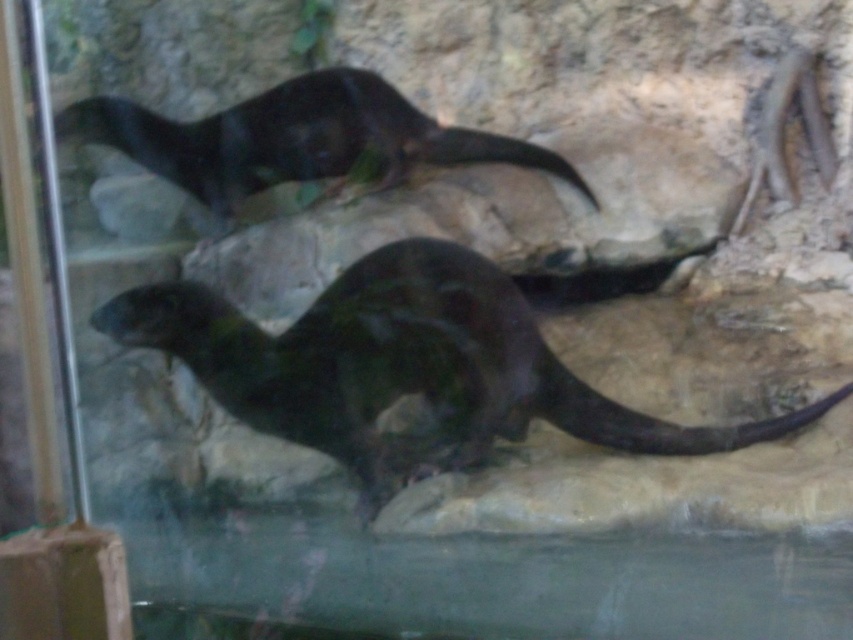
Who is higher up, shiny black otter at center or shiny black otter at upper center?

Positioned higher is shiny black otter at upper center.

Can you confirm if shiny black otter at center is bigger than shiny black otter at upper center?

Correct, shiny black otter at center is larger in size than shiny black otter at upper center.

Is point (343, 316) farther from viewer compared to point (374, 92)?

No.

The width and height of the screenshot is (853, 640). What are the coordinates of `shiny black otter at center` in the screenshot? It's located at (404, 368).